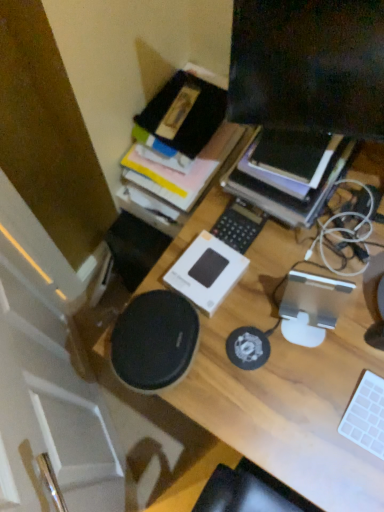
Question: Does wooden desk at center have a greater width compared to white matte keyboard at lower right, which is the second laptop keyboard from left to right?

Choices:
 (A) no
 (B) yes

Answer: (B)

Question: Would you say wooden desk at center contains white matte keyboard at lower right, the first laptop keyboard from the right?

Choices:
 (A) no
 (B) yes

Answer: (B)

Question: From the image's perspective, is wooden desk at center on white matte keyboard at lower right, acting as the second laptop keyboard starting from the back?

Choices:
 (A) yes
 (B) no

Answer: (A)

Question: Is wooden desk at center positioned with its back to white matte keyboard at lower right, which ranks as the first laptop keyboard in front-to-back order?

Choices:
 (A) no
 (B) yes

Answer: (A)

Question: Is wooden desk at center bigger than white matte keyboard at lower right, which is the second laptop keyboard from left to right?

Choices:
 (A) no
 (B) yes

Answer: (B)

Question: Can we say wooden desk at center lies outside white matte keyboard at lower right, acting as the second laptop keyboard starting from the back?

Choices:
 (A) yes
 (B) no

Answer: (A)

Question: Considering the relative positions of white plastic keyboard at center, the 1th laptop keyboard in the back-to-front sequence, and black matte speaker at center in the image provided, is white plastic keyboard at center, the 1th laptop keyboard in the back-to-front sequence, to the right of black matte speaker at center from the viewer's perspective?

Choices:
 (A) yes
 (B) no

Answer: (A)

Question: Is white plastic keyboard at center, which is counted as the first laptop keyboard, starting from the left, not near black matte speaker at center?

Choices:
 (A) no
 (B) yes

Answer: (A)

Question: Can you confirm if white plastic keyboard at center, the 1th laptop keyboard in the back-to-front sequence, is shorter than black matte speaker at center?

Choices:
 (A) no
 (B) yes

Answer: (B)

Question: Would you say black matte speaker at center is part of white plastic keyboard at center, which is counted as the first laptop keyboard, starting from the left,'s contents?

Choices:
 (A) no
 (B) yes

Answer: (A)

Question: From a real-world perspective, is white plastic keyboard at center, placed as the 2th laptop keyboard when sorted from right to left, under black matte speaker at center?

Choices:
 (A) no
 (B) yes

Answer: (B)

Question: Considering the relative sizes of white plastic keyboard at center, the 1th laptop keyboard in the back-to-front sequence, and black matte speaker at center in the image provided, is white plastic keyboard at center, the 1th laptop keyboard in the back-to-front sequence, bigger than black matte speaker at center?

Choices:
 (A) yes
 (B) no

Answer: (B)

Question: Does wooden desk at center have a greater height compared to white plastic keyboard at center, which is counted as the 2th laptop keyboard, starting from the front?

Choices:
 (A) yes
 (B) no

Answer: (A)